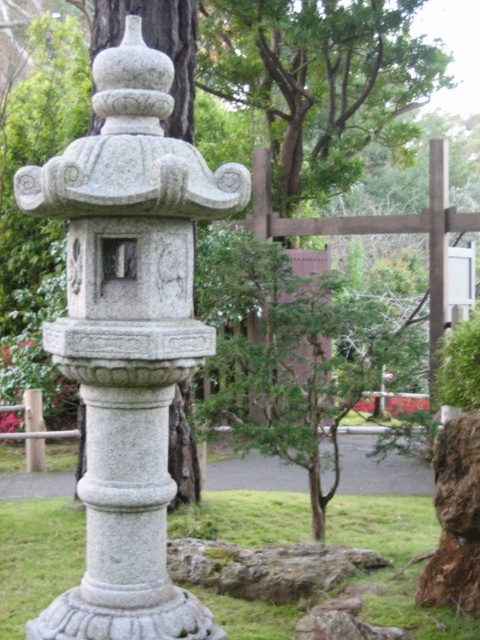
Question: Observing the image, what is the correct spatial positioning of gray stone lantern at center in reference to gray stone pillar at center?

Choices:
 (A) right
 (B) left

Answer: (B)

Question: Observing the image, what is the correct spatial positioning of gray stone lantern at center in reference to gray stone pillar at center?

Choices:
 (A) below
 (B) above

Answer: (B)

Question: Does gray stone lantern at center have a larger size compared to gray stone pillar at center?

Choices:
 (A) no
 (B) yes

Answer: (B)

Question: Which point is closer to the camera?

Choices:
 (A) (35, 576)
 (B) (159, 93)

Answer: (B)